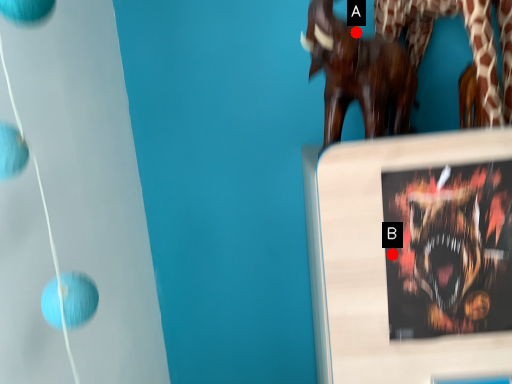
Question: Two points are circled on the image, labeled by A and B beside each circle. Among these points, which one is farthest from the camera?

Choices:
 (A) A is further
 (B) B is further

Answer: (A)